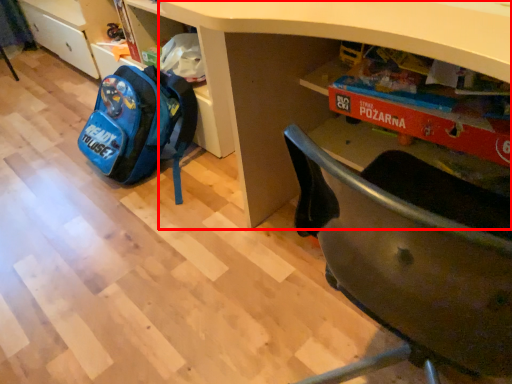
Question: Where is desk (annotated by the red box) located in relation to backpack in the image?

Choices:
 (A) right
 (B) left

Answer: (A)